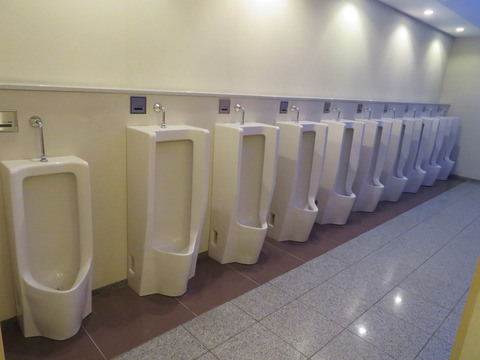
This screenshot has height=360, width=480. In order to click on urinals in this screenshot , I will do `click(49, 244)`, `click(197, 226)`, `click(243, 205)`, `click(292, 188)`, `click(331, 184)`, `click(371, 187)`, `click(398, 180)`, `click(417, 173)`, `click(430, 171)`, `click(446, 165)`.